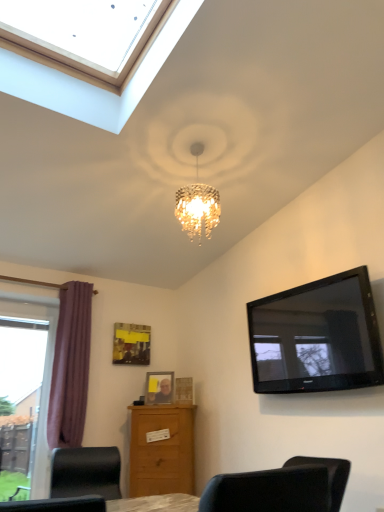
Image resolution: width=384 pixels, height=512 pixels. Describe the element at coordinates (162, 450) in the screenshot. I see `wooden chest of drawers at lower center` at that location.

What is the approximate width of wooden chest of drawers at lower center?

wooden chest of drawers at lower center is 15.42 inches in width.

Find the location of a particular element. The height and width of the screenshot is (512, 384). purple fabric curtain at left is located at coordinates (70, 367).

This screenshot has width=384, height=512. Find the location of `matte plastic picture frame at center, the second picture frame when ordered from left to right`. matte plastic picture frame at center, the second picture frame when ordered from left to right is located at coordinates (159, 387).

Can matte yellow paper at upper center, the 3th picture frame from the right, be found inside black glossy tv at upper right?

No, matte yellow paper at upper center, the 3th picture frame from the right, is not inside black glossy tv at upper right.

Is black glossy tv at upper right next to matte yellow paper at upper center, the 3th picture frame from the right, and touching it?

No, black glossy tv at upper right is not beside matte yellow paper at upper center, the 3th picture frame from the right.

From a real-world perspective, who is located higher, black glossy tv at upper right or matte yellow paper at upper center, which ranks as the first picture frame in left-to-right order?

From a 3D spatial view, matte yellow paper at upper center, which ranks as the first picture frame in left-to-right order, is above.

Is wooden photo frame at center, acting as the 1th picture frame starting from the right, to the left or to the right of purple fabric curtain at left in the image?

From the image, it's evident that wooden photo frame at center, acting as the 1th picture frame starting from the right, is to the right of purple fabric curtain at left.

From the picture: Is wooden photo frame at center, the third picture frame viewed from the left, beside purple fabric curtain at left?

wooden photo frame at center, the third picture frame viewed from the left, and purple fabric curtain at left are not in contact.

From the image's perspective, is wooden photo frame at center, acting as the 1th picture frame starting from the right, under purple fabric curtain at left?

Indeed, from the image's perspective, wooden photo frame at center, acting as the 1th picture frame starting from the right, is shown beneath purple fabric curtain at left.

Could purple fabric curtain at left be considered to be inside wooden photo frame at center, the third picture frame viewed from the left?

No.

From the image's perspective, which is above, transparent glass window at left or wooden chest of drawers at lower center?

transparent glass window at left, from the image's perspective.

Which is more to the left, transparent glass window at left or wooden chest of drawers at lower center?

transparent glass window at left is more to the left.

Is transparent glass window at left not inside wooden chest of drawers at lower center?

Yes.

Considering the positions of objects transparent glass window at left and wooden chest of drawers at lower center in the image provided, who is in front, transparent glass window at left or wooden chest of drawers at lower center?

Positioned in front is transparent glass window at left.

Is wooden chest of drawers at lower center inside the boundaries of black glossy tv at upper right, or outside?

wooden chest of drawers at lower center is not inside black glossy tv at upper right, it's outside.

Is wooden chest of drawers at lower center to the left or to the right of black glossy tv at upper right in the image?

From the image, it's evident that wooden chest of drawers at lower center is to the left of black glossy tv at upper right.

Looking at this image, does wooden chest of drawers at lower center have a lesser width compared to black glossy tv at upper right?

No.

Who is smaller, wooden chest of drawers at lower center or black glossy tv at upper right?

With smaller size is black glossy tv at upper right.

Where is `the 3rd picture frame to the left of the black glossy tv at upper right, counting from the anchor's position`? This screenshot has width=384, height=512. the 3rd picture frame to the left of the black glossy tv at upper right, counting from the anchor's position is located at coordinates (131, 344).

Considering the positions of objects matte yellow paper at upper center, the 3th picture frame from the right, and black glossy tv at upper right in the image provided, who is more to the left, matte yellow paper at upper center, the 3th picture frame from the right, or black glossy tv at upper right?

matte yellow paper at upper center, the 3th picture frame from the right, is more to the left.

Consider the image. Does matte yellow paper at upper center, which ranks as the first picture frame in left-to-right order, contain black glossy tv at upper right?

That's incorrect, black glossy tv at upper right is not inside matte yellow paper at upper center, which ranks as the first picture frame in left-to-right order.

Is matte plastic picture frame at center, the second picture frame when ordered from left to right, aimed at transparent glass window at left?

No, matte plastic picture frame at center, the second picture frame when ordered from left to right, is not facing towards transparent glass window at left.

Consider the image. Is matte plastic picture frame at center, the second picture frame when ordered from left to right, touching transparent glass window at left?

No, matte plastic picture frame at center, the second picture frame when ordered from left to right, is not next to transparent glass window at left.

Is black glossy tv at upper right inside the boundaries of transparent glass window at left, or outside?

black glossy tv at upper right lies outside transparent glass window at left.

Which object is further away from the camera taking this photo, black glossy tv at upper right or transparent glass window at left?

transparent glass window at left.

Are black glossy tv at upper right and transparent glass window at left beside each other?

They are not placed beside each other.

You are a GUI agent. You are given a task and a screenshot of the screen. Output one action in this format:
    pyautogui.click(x=<x>, y=<y>)
    Task: Click on the picture frame that is the 1st object located below the black glossy tv at upper right (from the image's perspective)
    
    Given the screenshot: What is the action you would take?
    pyautogui.click(x=131, y=344)

In order to click on the 1st picture frame behind the purple fabric curtain at left in this screenshot , I will do `click(184, 390)`.

In the scene shown: Looking at the image, which one is located closer to matte plastic picture frame at center, the second picture frame when ordered from left to right, matte yellow paper at upper center, the 3th picture frame from the right, or transparent glass window at left?

Among the two, matte yellow paper at upper center, the 3th picture frame from the right, is located nearer to matte plastic picture frame at center, the second picture frame when ordered from left to right.

Based on their spatial positions, is purple fabric curtain at left or matte plastic picture frame at center, the 2th picture frame viewed from the right, closer to transparent glass window at left?

The object closer to transparent glass window at left is purple fabric curtain at left.

When comparing their distances from black leather chair at lower left, does wooden photo frame at center, the third picture frame viewed from the left, or matte yellow paper at upper center, which ranks as the first picture frame in left-to-right order, seem closer?

wooden photo frame at center, the third picture frame viewed from the left, lies closer to black leather chair at lower left than the other object.

Considering their positions, is wooden photo frame at center, acting as the 1th picture frame starting from the right, positioned closer to transparent glass window at left than wooden chest of drawers at lower center?

wooden chest of drawers at lower center is positioned closer to the anchor transparent glass window at left.

Which object lies nearer to the anchor point purple fabric curtain at left, black glossy tv at upper right or black leather chair at lower left?

A: Based on the image, black leather chair at lower left appears to be nearer to purple fabric curtain at left.

Based on their spatial positions, is black leather chair at lower left or matte yellow paper at upper center, which ranks as the first picture frame in left-to-right order, further from transparent glass window at left?

black leather chair at lower left is positioned further to the anchor transparent glass window at left.

Based on the photo, which object lies nearer to the anchor point wooden photo frame at center, acting as the 1th picture frame starting from the right, purple fabric curtain at left or matte plastic picture frame at center, the 2th picture frame viewed from the right?

matte plastic picture frame at center, the 2th picture frame viewed from the right, is positioned closer to the anchor wooden photo frame at center, acting as the 1th picture frame starting from the right.

Which object lies further to the anchor point black glossy tv at upper right, transparent glass window at left or wooden photo frame at center, the third picture frame viewed from the left?

transparent glass window at left lies further to black glossy tv at upper right than the other object.

Image resolution: width=384 pixels, height=512 pixels. What are the coordinates of `chair between purple fabric curtain at left and black glossy tv at upper right` in the screenshot? It's located at coord(85,472).

I want to click on chair situated between transparent glass window at left and black glossy tv at upper right from left to right, so [85, 472].

Identify the location of chest of drawers between black glossy tv at upper right and matte yellow paper at upper center, the 3th picture frame from the right, from front to back. (162, 450).

Identify the location of television located between black leather chair at lower left and matte plastic picture frame at center, the 2th picture frame viewed from the right, in the depth direction. (316, 337).